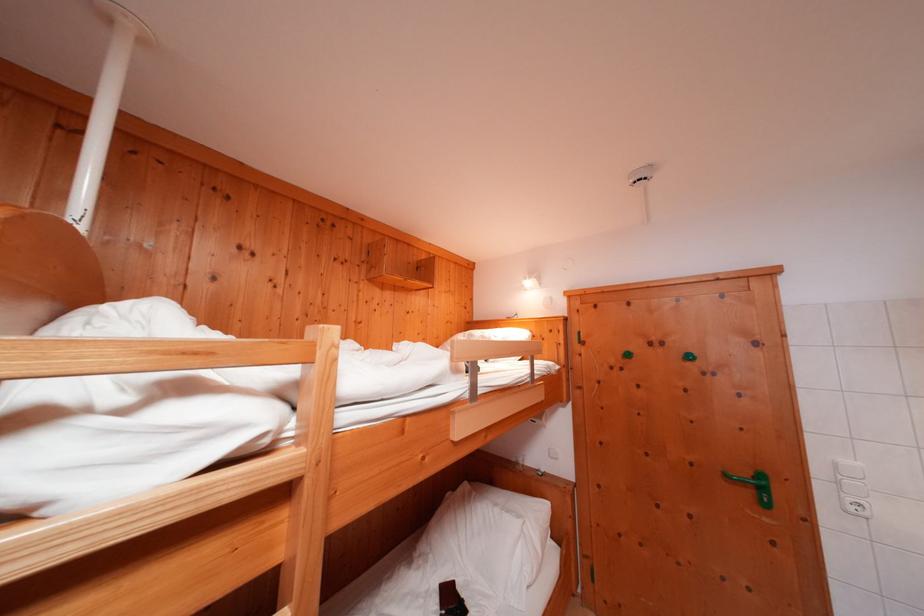
The height and width of the screenshot is (616, 924). What do you see at coordinates (756, 485) in the screenshot?
I see `a green climbing hold` at bounding box center [756, 485].